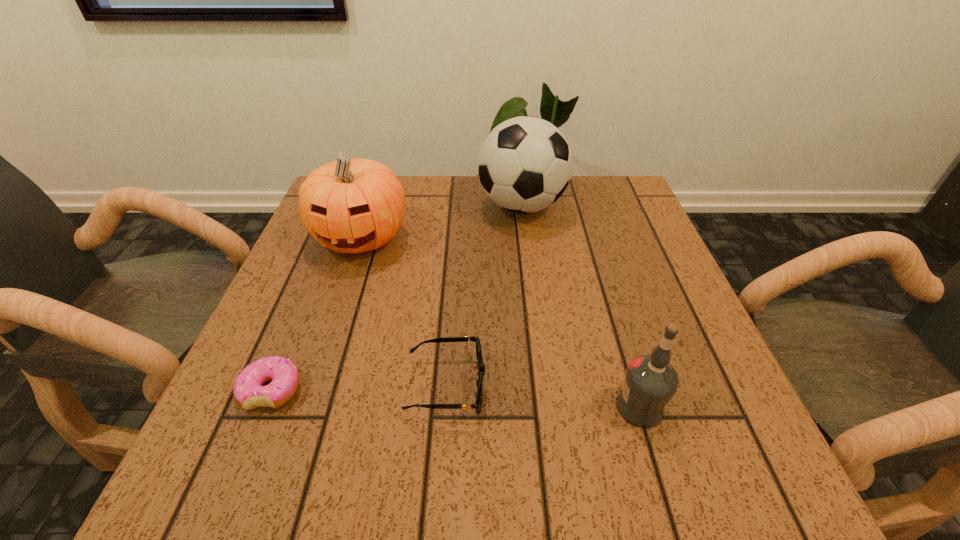
What are the coordinates of `vacant region at the left edge` in the screenshot? It's located at (348, 309).

In the image, there is a desktop. What are the coordinates of `free space at the right edge` in the screenshot? It's located at (x=637, y=226).

Identify the location of free region at the far right corner of the desktop. This screenshot has height=540, width=960. (x=572, y=176).

Find the location of a particular element. empty space that is in between the pumpkin and the sunglasses is located at coordinates (403, 312).

Image resolution: width=960 pixels, height=540 pixels. In order to click on vacant area that lies between the pumpkin and the sunglasses in this screenshot , I will do `click(403, 312)`.

Where is `free space between the pumpkin and the sunglasses`? The height and width of the screenshot is (540, 960). free space between the pumpkin and the sunglasses is located at coordinates (403, 312).

The image size is (960, 540). What are the coordinates of `vacant point located between the pumpkin and the sunglasses` in the screenshot? It's located at (403, 312).

Where is `vacant space that is in between the vodka and the pumpkin`? vacant space that is in between the vodka and the pumpkin is located at coordinates (500, 322).

Identify the location of vacant area between the doughnut and the sunglasses. (359, 388).

Where is `free area in between the pumpkin and the vodka`? This screenshot has width=960, height=540. free area in between the pumpkin and the vodka is located at coordinates (500, 322).